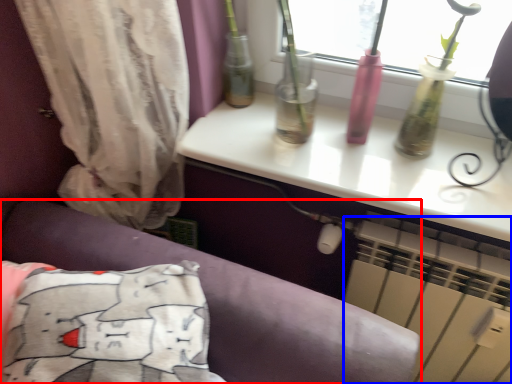
Question: Which point is further to the camera, furniture (highlighted by a red box) or air conditioning (highlighted by a blue box)?

Choices:
 (A) furniture
 (B) air conditioning

Answer: (B)